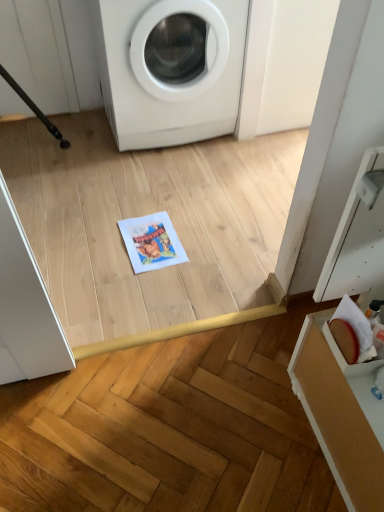
At what (x,y) coordinates should I click in order to perform the action: click on vacant space situated above printed paper at center (from a real-world perspective). Please return your answer as a coordinate pair (x, y). Looking at the image, I should click on (154, 240).